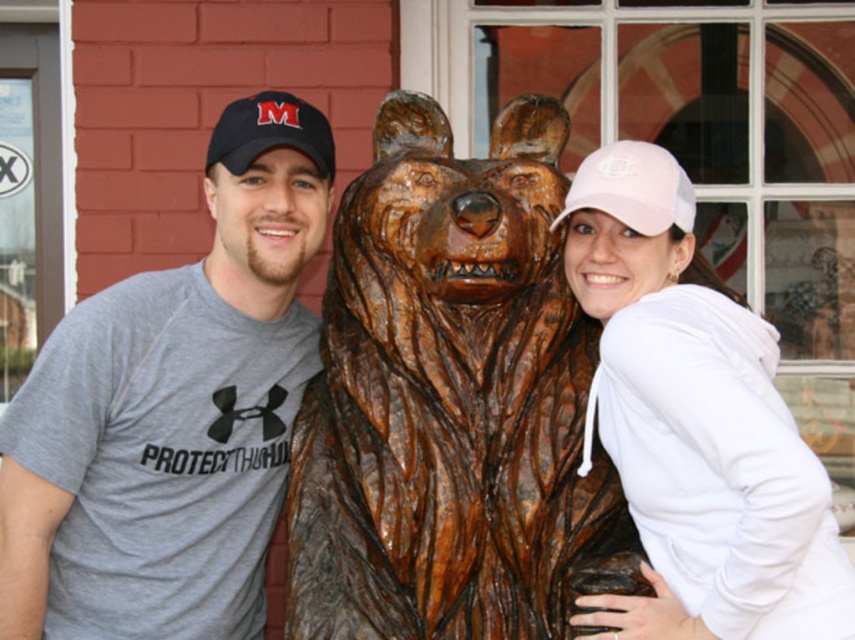
Based on the photo, between pink mesh cap at center and pink mesh baseball cap at upper right, which one appears on the right side from the viewer's perspective?

From the viewer's perspective, pink mesh cap at center appears more on the right side.

Between pink mesh cap at center and pink mesh baseball cap at upper right, which one has less height?

pink mesh baseball cap at upper right

Is point (724, 518) more distant than point (570, 209)?

No, it is in front of (570, 209).

Find the location of a particular element. The width and height of the screenshot is (855, 640). pink mesh cap at center is located at coordinates (694, 426).

Can you confirm if pink mesh baseball cap at upper right is positioned to the left of black fabric cap at left?

Incorrect, pink mesh baseball cap at upper right is not on the left side of black fabric cap at left.

Is pink mesh baseball cap at upper right below black fabric cap at left?

Indeed, pink mesh baseball cap at upper right is positioned under black fabric cap at left.

Is point (618, 193) positioned after point (227, 113)?

No, it is not.

Find the location of a particular element. Image resolution: width=855 pixels, height=640 pixels. pink mesh baseball cap at upper right is located at coordinates (634, 188).

Who is lower down, wooden bear at center or pink mesh baseball cap at upper right?

Positioned lower is wooden bear at center.

Between wooden bear at center and pink mesh baseball cap at upper right, which one has more height?

With more height is wooden bear at center.

Locate an element on the screen. The width and height of the screenshot is (855, 640). wooden bear at center is located at coordinates (451, 401).